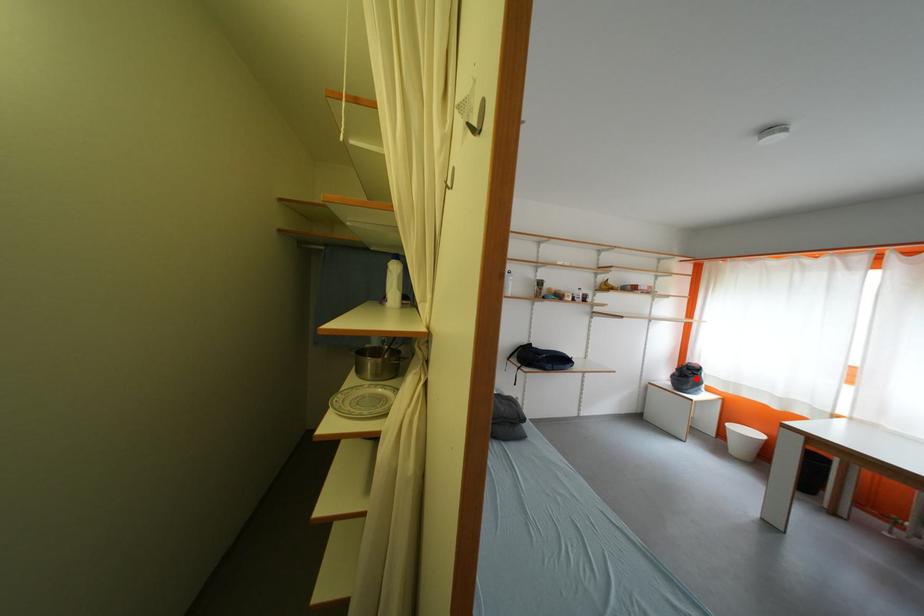
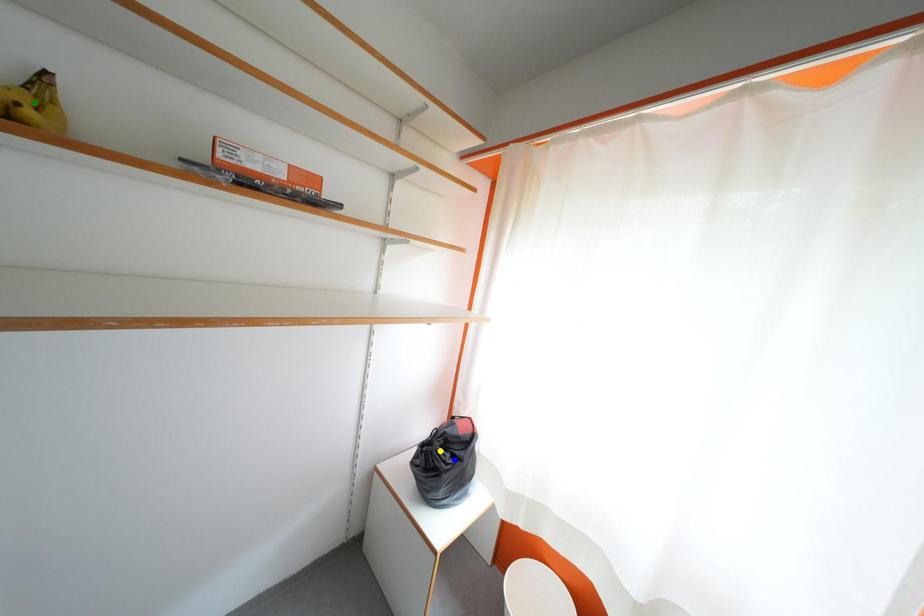
Question: I am providing you with two images of the same scene from different viewpoints. A red point is marked on the first image. You are given multiple points on the second image. Which point in image 2 represents the same 3d spot as the red point in image 1?

Choices:
 (A) blue point
 (B) green point
 (C) yellow point

Answer: (A)